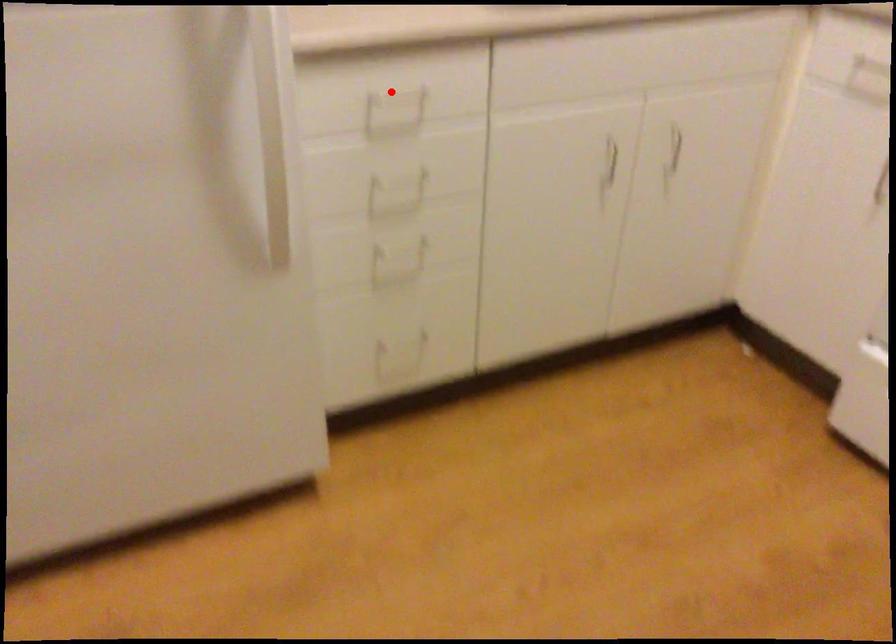
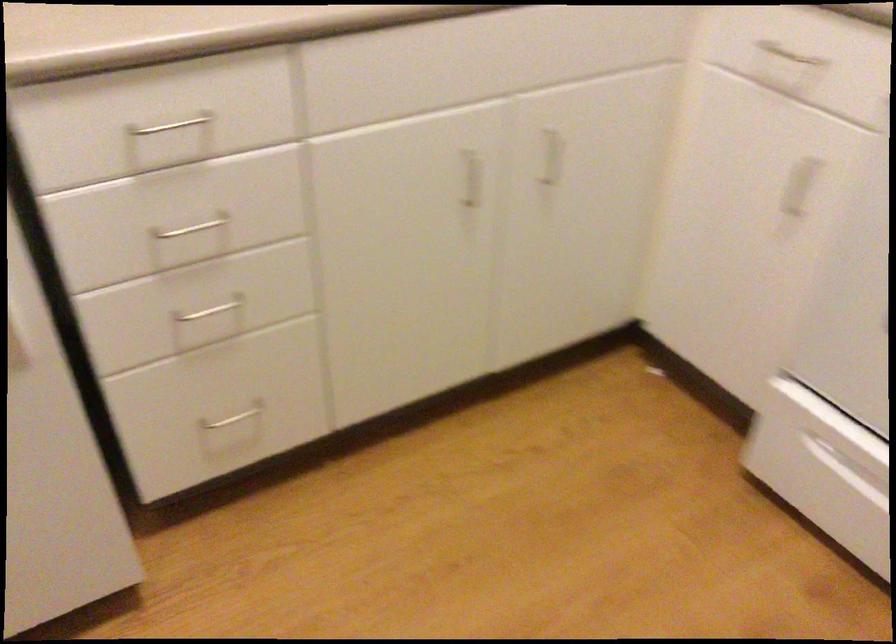
Question: I am providing you with two images of the same scene from different viewpoints. In image1, a red point is highlighted. Considering the same 3D point in image2, which of the following is correct?

Choices:
 (A) It is closer
 (B) It is farther

Answer: (A)